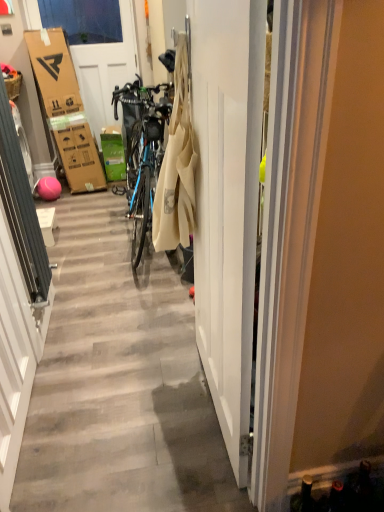
Question: In the image, is white glossy door at center, the 2th door viewed from the top, on the left side or the right side of matte brown picnic basket at left?

Choices:
 (A) left
 (B) right

Answer: (B)

Question: From the image's perspective, relative to matte brown picnic basket at left, is white glossy door at center, the first door positioned from the front, above or below?

Choices:
 (A) above
 (B) below

Answer: (B)

Question: Which object is positioned farthest from the matte brown picnic basket at left?

Choices:
 (A) white glossy door at center, marked as the first door in a right-to-left arrangement
 (B) matte blue bicycle at center
 (C) white cardboard at upper left, which ranks as the first door in left-to-right order

Answer: (C)

Question: Which object is positioned closest to the matte blue bicycle at center?

Choices:
 (A) white glossy door at center, which is the 2th door in left-to-right order
 (B) white cardboard at upper left, acting as the second door starting from the front
 (C) matte brown picnic basket at left

Answer: (A)